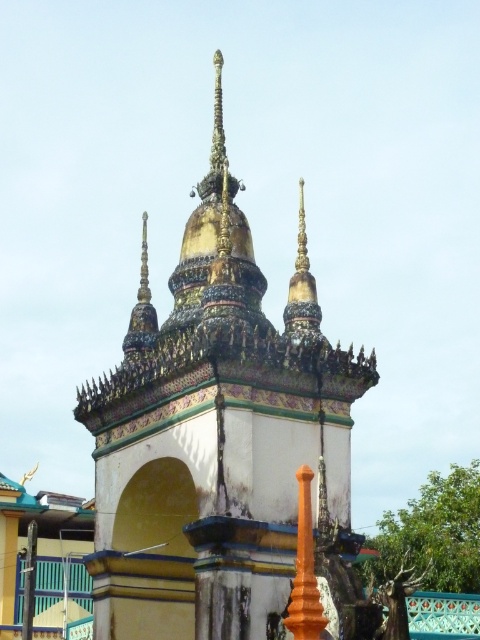
You are an architect examining the temple structure. Based on the coordinates provided, which temple feature does the point at (214, 435) correspond to?

The point at (214, 435) corresponds to the gold mosaic temple at center.

You are an architect examining the temple structure. You need to determine which object is bigger between the gold mosaic temple at center and the orange polished pillar at center. Which one is larger?

The gold mosaic temple at center is larger in size than the orange polished pillar at center.

What are the coordinates of the gold mosaic temple at center?

The gold mosaic temple at center is located at coordinates point (214, 435).